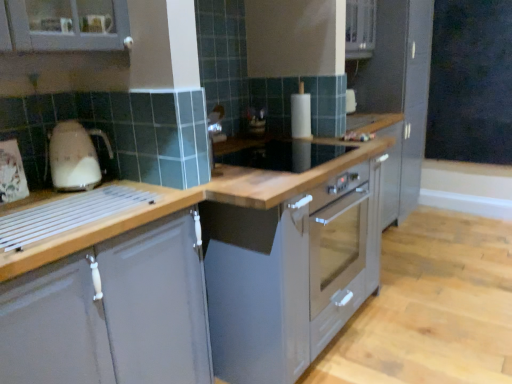
Find the location of a particular element. matte gray cabinet at left, which is the first cabinetry in left-to-right order is located at coordinates (112, 312).

What do you see at coordinates (400, 92) in the screenshot? This screenshot has width=512, height=384. I see `satin grey cabinet at right, the 1th cabinetry in the top-to-bottom sequence` at bounding box center [400, 92].

What do you see at coordinates (74, 156) in the screenshot?
I see `beige glossy kettle at left` at bounding box center [74, 156].

Find the location of a particular element. This screenshot has width=512, height=384. black matte chalkboard at upper right is located at coordinates coord(471,82).

Which of these two, white paper towel holder at center or matte gray cabinet at left, which is the first cabinetry in left-to-right order, is wider?

Wider between the two is matte gray cabinet at left, which is the first cabinetry in left-to-right order.

Are white paper towel holder at center and matte gray cabinet at left, which is the first cabinetry in left-to-right order, making contact?

No, white paper towel holder at center is not making contact with matte gray cabinet at left, which is the first cabinetry in left-to-right order.

Which point is more forward, (x=310, y=100) or (x=130, y=315)?

Positioned in front is point (x=130, y=315).

Is beige glossy kettle at left next to black matte chalkboard at upper right?

No, beige glossy kettle at left is not touching black matte chalkboard at upper right.

Which of these two, beige glossy kettle at left or black matte chalkboard at upper right, is smaller?

With smaller size is beige glossy kettle at left.

Considering the positions of objects beige glossy kettle at left and black matte chalkboard at upper right in the image provided, who is more to the right, beige glossy kettle at left or black matte chalkboard at upper right?

black matte chalkboard at upper right.

Could you tell me if beige glossy kettle at left is turned towards black matte chalkboard at upper right?

No, beige glossy kettle at left is not aimed at black matte chalkboard at upper right.

Is beige glossy kettle at left at the left side of white paper towel holder at center?

Correct, you'll find beige glossy kettle at left to the left of white paper towel holder at center.

From a real-world perspective, is beige glossy kettle at left above or below white paper towel holder at center?

From a real-world perspective, beige glossy kettle at left is physically below white paper towel holder at center.

Does beige glossy kettle at left have a greater height compared to white paper towel holder at center?

In fact, beige glossy kettle at left may be shorter than white paper towel holder at center.

How distant is beige glossy kettle at left from white paper towel holder at center?

A distance of 1.19 meters exists between beige glossy kettle at left and white paper towel holder at center.

Is black matte chalkboard at upper right at the back of satin grey cabinet at right, positioned as the 2th cabinetry in bottom-to-top order?

satin grey cabinet at right, positioned as the 2th cabinetry in bottom-to-top order, is not turned away from black matte chalkboard at upper right.

Measure the distance from satin grey cabinet at right, arranged as the 1th cabinetry when viewed from the back, to black matte chalkboard at upper right.

A distance of 17.02 inches exists between satin grey cabinet at right, arranged as the 1th cabinetry when viewed from the back, and black matte chalkboard at upper right.

Is satin grey cabinet at right, arranged as the 1th cabinetry when viewed from the back, situated inside black matte chalkboard at upper right or outside?

satin grey cabinet at right, arranged as the 1th cabinetry when viewed from the back, is not inside black matte chalkboard at upper right, it's outside.

Is point (387, 59) positioned before point (510, 31)?

Yes.

From the image's perspective, relative to satin silver oven at center, is matte gray cabinet at left, positioned as the second cabinetry in back-to-front order, above or below?

matte gray cabinet at left, positioned as the second cabinetry in back-to-front order, is situated lower than satin silver oven at center in the image.

Is matte gray cabinet at left, the first cabinetry when ordered from bottom to top, not within satin silver oven at center?

Yes, matte gray cabinet at left, the first cabinetry when ordered from bottom to top, is not within satin silver oven at center.

In the scene shown: Between matte gray cabinet at left, placed as the first cabinetry when sorted from front to back, and satin silver oven at center, which one appears on the right side from the viewer's perspective?

Positioned to the right is satin silver oven at center.

Considering the positions of points (201, 331) and (310, 321), is point (201, 331) closer to camera compared to point (310, 321)?

Yes, it is.

Which is correct: black matte chalkboard at upper right is inside satin grey cabinet at right, arranged as the 1th cabinetry when viewed from the back, or outside of it?

black matte chalkboard at upper right is not inside satin grey cabinet at right, arranged as the 1th cabinetry when viewed from the back, it's outside.

Which is further, (429, 143) or (397, 91)?

The point (429, 143) is behind.

How far apart are black matte chalkboard at upper right and satin grey cabinet at right, positioned as the 2th cabinetry in bottom-to-top order?

black matte chalkboard at upper right and satin grey cabinet at right, positioned as the 2th cabinetry in bottom-to-top order, are 43.24 centimeters apart.

From a real-world perspective, which is physically above, black matte chalkboard at upper right or satin grey cabinet at right, arranged as the 1th cabinetry when viewed from the back?

From a 3D spatial view, black matte chalkboard at upper right is above.

Can you confirm if white paper towel holder at center is thinner than black matte chalkboard at upper right?

Incorrect, the width of white paper towel holder at center is not less than that of black matte chalkboard at upper right.

From a real-world perspective, is white paper towel holder at center below black matte chalkboard at upper right?

Yes, from a real-world perspective, white paper towel holder at center is under black matte chalkboard at upper right.

What's the angular difference between white paper towel holder at center and black matte chalkboard at upper right's facing directions?

92.5 degrees.

At what (x,y) coordinates should I click in order to perform the action: click on kitchen appliance above the matte gray cabinet at left, positioned as the second cabinetry in back-to-front order (from the image's perspective). Please return your answer as a coordinate pair (x, y). Looking at the image, I should click on (301, 115).

The height and width of the screenshot is (384, 512). In order to click on home appliance on the left side of black matte chalkboard at upper right in this screenshot , I will do `click(74, 156)`.

From the image, which object appears to be farther from black matte chalkboard at upper right, white paper towel holder at center or beige glossy kettle at left?

beige glossy kettle at left lies further to black matte chalkboard at upper right than the other object.

Which object lies further to the anchor point black matte chalkboard at upper right, satin grey cabinet at right, which is the 2th cabinetry from left to right, or matte gray cabinet at left, placed as the first cabinetry when sorted from front to back?

Based on the image, matte gray cabinet at left, placed as the first cabinetry when sorted from front to back, appears to be further to black matte chalkboard at upper right.

Based on their spatial positions, is black matte chalkboard at upper right or matte gray cabinet at left, positioned as the second cabinetry in top-to-bottom order, further from beige glossy kettle at left?

The object further to beige glossy kettle at left is black matte chalkboard at upper right.

Estimate the real-world distances between objects in this image. Which object is further from black matte chalkboard at upper right, beige glossy kettle at left or matte gray cabinet at left, which ranks as the second cabinetry in right-to-left order?

matte gray cabinet at left, which ranks as the second cabinetry in right-to-left order, is further to black matte chalkboard at upper right.

Which object lies nearer to the anchor point black matte chalkboard at upper right, beige glossy kettle at left or satin silver oven at center?

satin silver oven at center.

From the picture: From the image, which object appears to be nearer to beige glossy kettle at left, satin grey cabinet at right, arranged as the 1th cabinetry when viewed from the back, or black matte chalkboard at upper right?

Based on the image, satin grey cabinet at right, arranged as the 1th cabinetry when viewed from the back, appears to be nearer to beige glossy kettle at left.

Which object lies nearer to the anchor point white paper towel holder at center, black matte chalkboard at upper right or matte gray cabinet at left, the first cabinetry when ordered from bottom to top?

matte gray cabinet at left, the first cabinetry when ordered from bottom to top.

Considering their positions, is satin silver oven at center positioned further to black matte chalkboard at upper right than beige glossy kettle at left?

beige glossy kettle at left is positioned further to the anchor black matte chalkboard at upper right.

Find the location of a particular element. The image size is (512, 384). kitchen appliance situated between beige glossy kettle at left and black matte chalkboard at upper right from left to right is located at coordinates (301, 115).

Identify the location of oven positioned between matte gray cabinet at left, positioned as the second cabinetry in top-to-bottom order, and white paper towel holder at center from near to far. This screenshot has width=512, height=384. (288, 276).

Find the location of a particular element. home appliance located between matte gray cabinet at left, which is the first cabinetry in left-to-right order, and white paper towel holder at center in the depth direction is located at coordinates (74, 156).

Find the location of `kitchen appliance positioned between matte gray cabinet at left, which ranks as the second cabinetry in right-to-left order, and satin grey cabinet at right, the 1th cabinetry in the top-to-bottom sequence, from near to far`. kitchen appliance positioned between matte gray cabinet at left, which ranks as the second cabinetry in right-to-left order, and satin grey cabinet at right, the 1th cabinetry in the top-to-bottom sequence, from near to far is located at coordinates (301, 115).